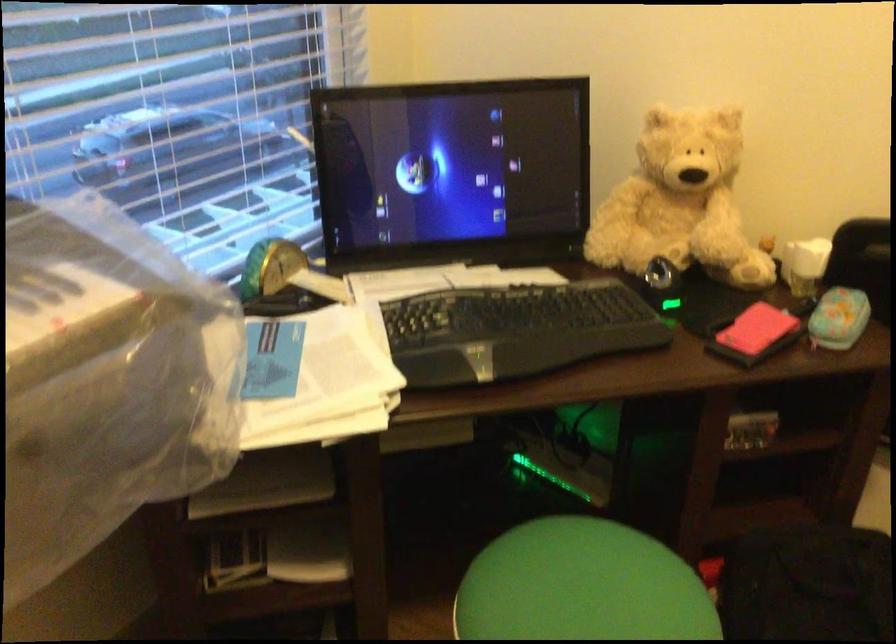
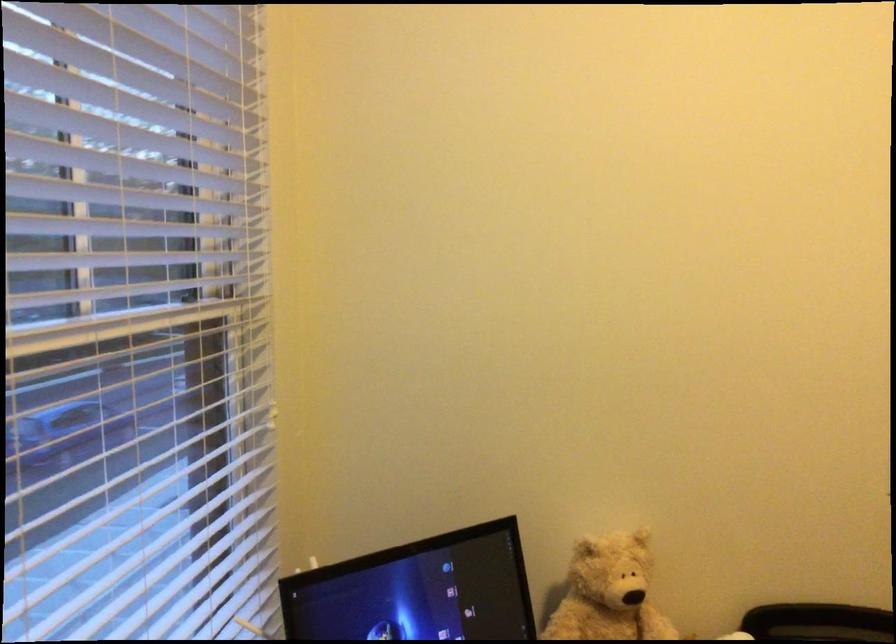
The images are taken continuously from a first-person perspective. In which direction is your viewpoint rotating?

The rotation direction of the camera is right-up.